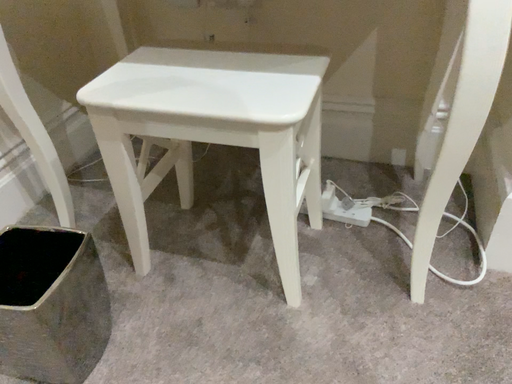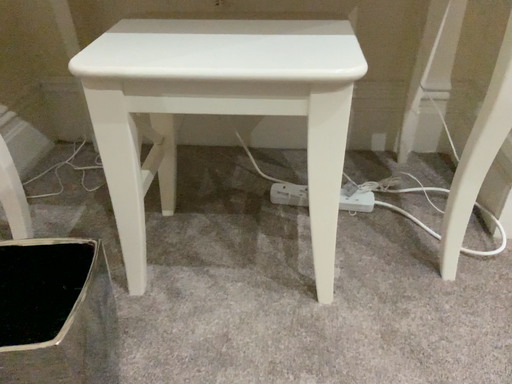
Question: How did the camera likely rotate when shooting the video?

Choices:
 (A) rotated left
 (B) rotated right

Answer: (B)